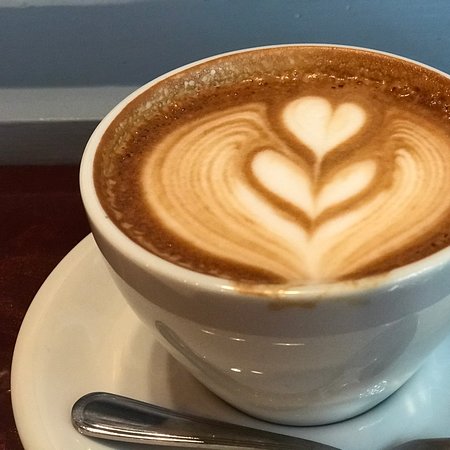
Locate an element on the screen. white cup is located at coordinates (309, 349).